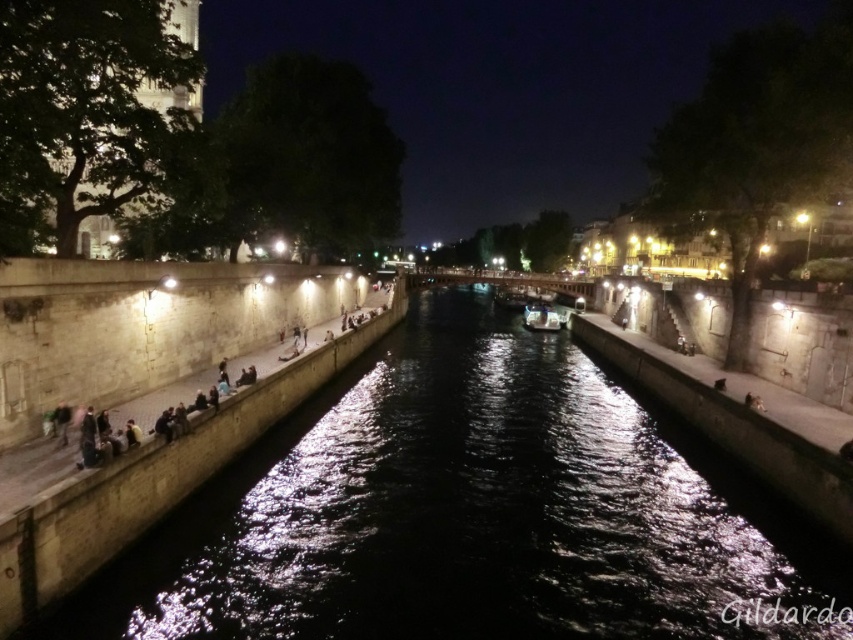
You are standing at the center of the canal in the nighttime scene. You see a point marked at coordinates (x=119, y=106). What object does this point indicate?

The point at coordinates (x=119, y=106) corresponds to the smooth stone tower at upper left.

You are a tourist standing on the left side of the canal, where the people are gathered under the warm streetlights. You want to take a photo of the shiny silver boat at center and the smooth stone tower at upper left in the same frame. Which object should be positioned to the left in your photo?

The smooth stone tower at upper left should be positioned to the left in your photo because it is located to the left of the shiny silver boat at center according to the description.

You are a tourist standing at the edge of the canal, looking towards the smooth stone tower at upper left and the shiny silver boat at center. Which object is positioned higher from the ground level?

The smooth stone tower at upper left is located above the shiny silver boat at center, so it is positioned higher from the ground level.